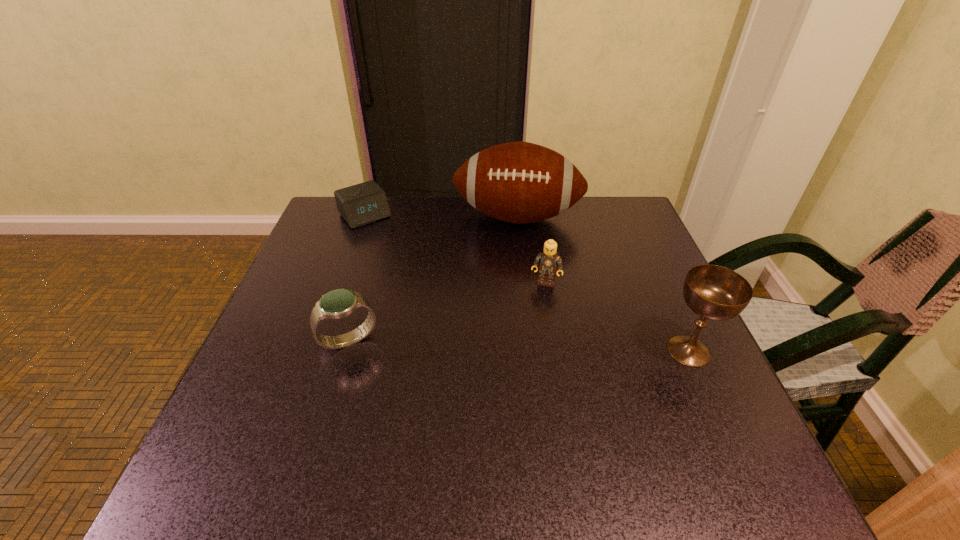
This screenshot has height=540, width=960. I want to click on vacant space on the desktop that is between the watch and the second tallest object and is positioned on the laces of the football, so click(502, 345).

At what (x,y) coordinates should I click in order to perform the action: click on vacant spot on the desktop that is between the watch and the chalice and is positioned on the front-facing side of the shortest object. Please return your answer as a coordinate pair (x, y). This screenshot has width=960, height=540. Looking at the image, I should click on pos(472,344).

Image resolution: width=960 pixels, height=540 pixels. Identify the location of vacant space on the desktop that is between the watch and the chalice and is positioned in front of the Lego. (530, 346).